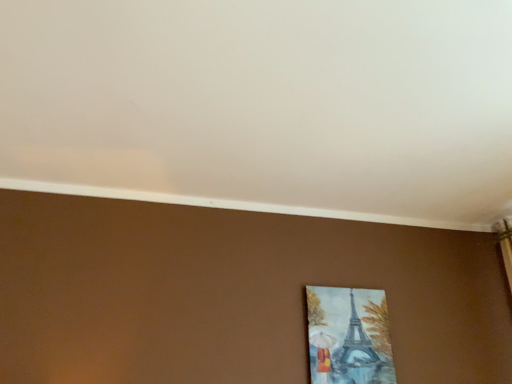
The width and height of the screenshot is (512, 384). Describe the element at coordinates (349, 336) in the screenshot. I see `watercolor painting of eiffel tower at lower right` at that location.

Where is `watercolor painting of eiffel tower at lower right`? This screenshot has height=384, width=512. watercolor painting of eiffel tower at lower right is located at coordinates (349, 336).

At what (x,y) coordinates should I click in order to perform the action: click on watercolor painting of eiffel tower at lower right. Please return your answer as a coordinate pair (x, y). This screenshot has height=384, width=512. Looking at the image, I should click on (349, 336).